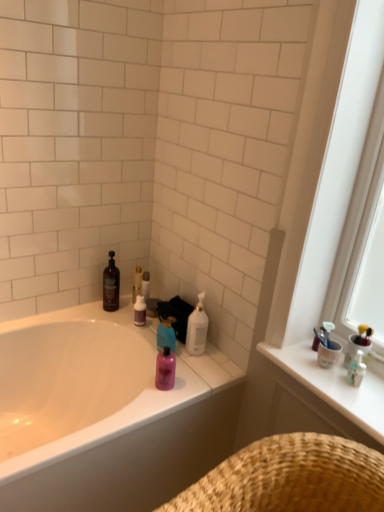
Question: Does purple matte bottle at center, positioned as the 1th toiletry in back-to-front order, come behind blue glossy bottle at center, which ranks as the second cleaning product in left-to-right order?

Choices:
 (A) yes
 (B) no

Answer: (A)

Question: Is purple matte bottle at center, positioned as the 1th toiletry in back-to-front order, facing away from blue glossy bottle at center, arranged as the 2th cleaning product when viewed from the right?

Choices:
 (A) no
 (B) yes

Answer: (A)

Question: Is purple matte bottle at center, the third toiletry positioned from the right, smaller than blue glossy bottle at center, which ranks as the second cleaning product in left-to-right order?

Choices:
 (A) no
 (B) yes

Answer: (B)

Question: Is purple matte bottle at center, positioned as the 1th toiletry in back-to-front order, thinner than blue glossy bottle at center, which ranks as the second cleaning product in left-to-right order?

Choices:
 (A) yes
 (B) no

Answer: (A)

Question: From a real-world perspective, is purple matte bottle at center, positioned as the 1th toiletry in back-to-front order, over blue glossy bottle at center, which ranks as the second cleaning product in left-to-right order?

Choices:
 (A) no
 (B) yes

Answer: (B)

Question: Would you say white glossy counter top at upper right is to the left or to the right of matte white bathtub at center in the picture?

Choices:
 (A) right
 (B) left

Answer: (A)

Question: Does point (337, 411) appear closer or farther from the camera than point (152, 395)?

Choices:
 (A) closer
 (B) farther

Answer: (A)

Question: From a real-world perspective, is white glossy counter top at upper right above or below matte white bathtub at center?

Choices:
 (A) above
 (B) below

Answer: (A)

Question: Would you say white glossy counter top at upper right is inside or outside matte white bathtub at center?

Choices:
 (A) outside
 (B) inside

Answer: (A)

Question: Considering the relative positions of matte black bottle at upper left, arranged as the third cleaning product when viewed from the right, and white glossy bottle at upper center, marked as the first cleaning product in a right-to-left arrangement, in the image provided, is matte black bottle at upper left, arranged as the third cleaning product when viewed from the right, to the left or to the right of white glossy bottle at upper center, marked as the first cleaning product in a right-to-left arrangement,?

Choices:
 (A) left
 (B) right

Answer: (A)

Question: From a real-world perspective, is matte black bottle at upper left, arranged as the third cleaning product when viewed from the right, physically located above or below white glossy bottle at upper center, which appears as the third cleaning product when viewed from the left?

Choices:
 (A) above
 (B) below

Answer: (A)

Question: Is point (109, 286) positioned closer to the camera than point (190, 317)?

Choices:
 (A) closer
 (B) farther

Answer: (B)

Question: Is matte black bottle at upper left, arranged as the third cleaning product when viewed from the right, in front of or behind white glossy bottle at upper center, marked as the first cleaning product in a right-to-left arrangement, in the image?

Choices:
 (A) behind
 (B) front

Answer: (A)

Question: Looking at their shapes, would you say white glossy counter top at upper right is wider or thinner than translucent plastic toothbrush holder at upper right, which is counted as the 1th toiletry, starting from the front?

Choices:
 (A) wide
 (B) thin

Answer: (A)

Question: Based on their positions, is white glossy counter top at upper right located to the left or right of translucent plastic toothbrush holder at upper right, the 1th toiletry from the right?

Choices:
 (A) left
 (B) right

Answer: (A)